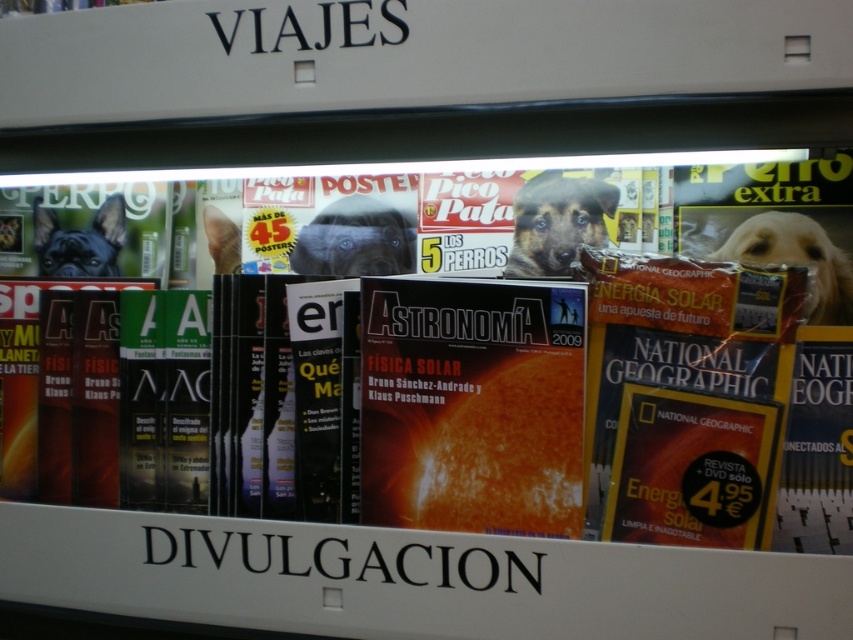
Question: Is matte black dog at center to the left of golden fur dog at right from the viewer's perspective?

Choices:
 (A) no
 (B) yes

Answer: (B)

Question: Considering the real-world distances, which object is farthest from the matte orange magazine at center?

Choices:
 (A) matte black dog at center
 (B) brown fur dog at center

Answer: (A)

Question: Is matte orange magazine at center bigger than black matte dog at left?

Choices:
 (A) yes
 (B) no

Answer: (A)

Question: Which point appears farthest from the camera in this image?

Choices:
 (A) (62, 260)
 (B) (724, 246)
 (C) (561, 236)
 (D) (329, 332)

Answer: (A)

Question: Which object is positioned farthest from the matte orange magazine at center?

Choices:
 (A) golden fur dog at right
 (B) light brown fur at center

Answer: (B)

Question: Does orange matte magazine at center have a smaller size compared to matte black dog at center?

Choices:
 (A) yes
 (B) no

Answer: (B)